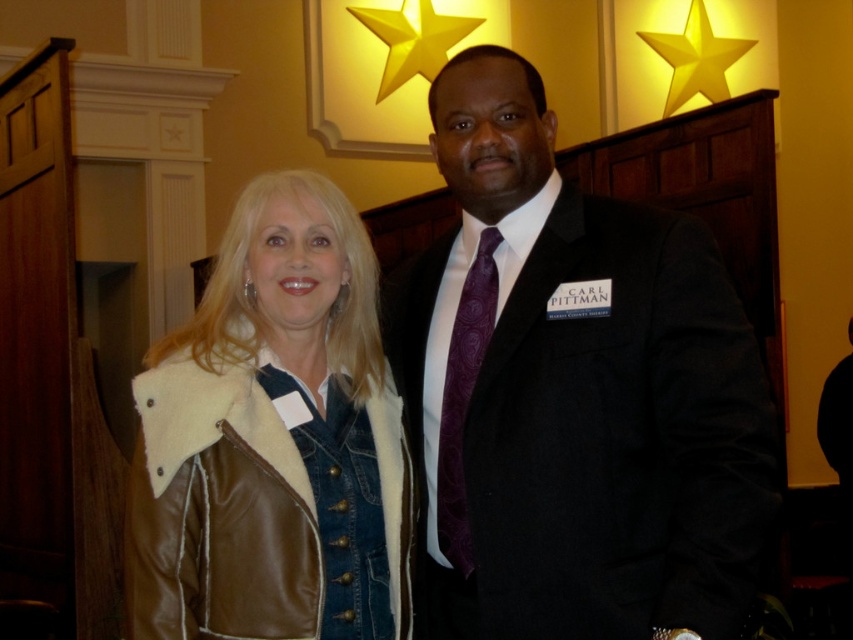
Who is shorter, purple satin tie at center or gold metallic star at upper center?

purple satin tie at center is shorter.

Does purple satin tie at center appear under gold metallic star at upper center?

Yes, purple satin tie at center is below gold metallic star at upper center.

Is point (471, 554) positioned behind point (418, 33)?

No, (471, 554) is in front of (418, 33).

Where is `purple satin tie at center`? Image resolution: width=853 pixels, height=640 pixels. purple satin tie at center is located at coordinates (463, 397).

Who is more distant from viewer, (537, 355) or (727, 54)?

The point (727, 54) is more distant.

Between matte black suit at center and yellow paper star at upper center, which one appears on the right side from the viewer's perspective?

yellow paper star at upper center

Who is more distant from viewer, [544,285] or [688,83]?

Positioned behind is point [688,83].

The height and width of the screenshot is (640, 853). Identify the location of matte black suit at center. (572, 396).

Is matte black suit at center wider than purple satin tie at center?

Correct, the width of matte black suit at center exceeds that of purple satin tie at center.

Who is higher up, matte black suit at center or purple satin tie at center?

Positioned higher is matte black suit at center.

What do you see at coordinates (572, 396) in the screenshot?
I see `matte black suit at center` at bounding box center [572, 396].

Where is `matte black suit at center`? This screenshot has height=640, width=853. matte black suit at center is located at coordinates (572, 396).